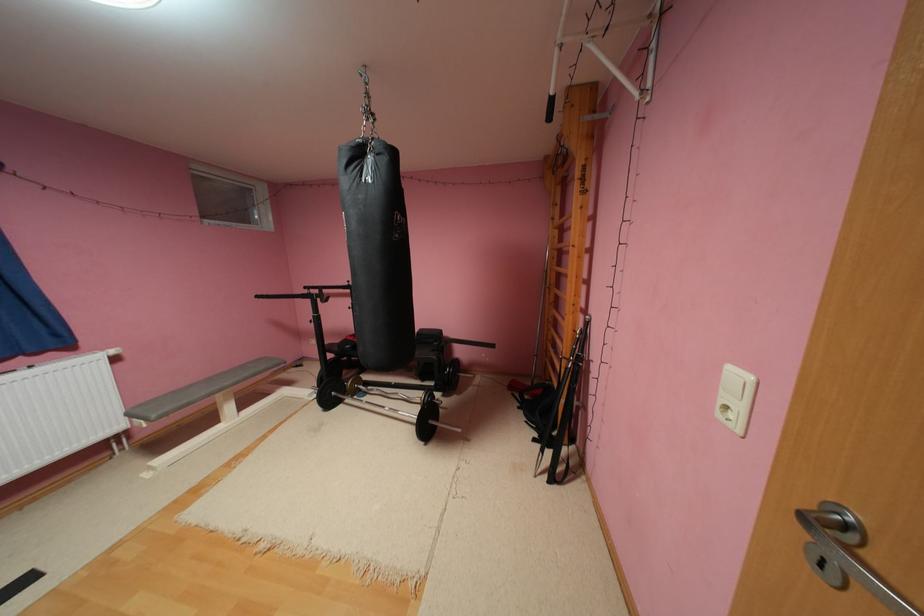
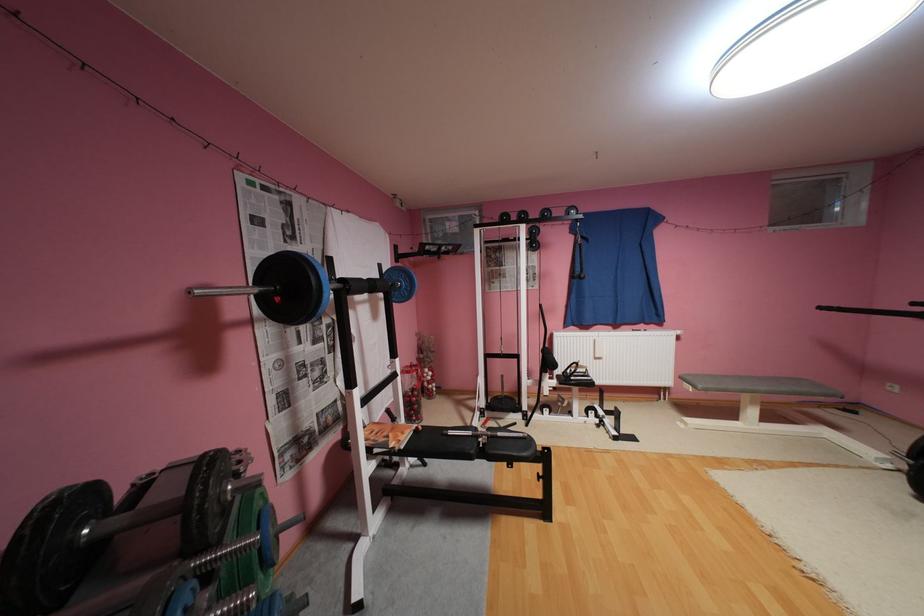
The point at (227,422) is marked in the first image. Where is the corresponding point in the second image?

(746, 419)